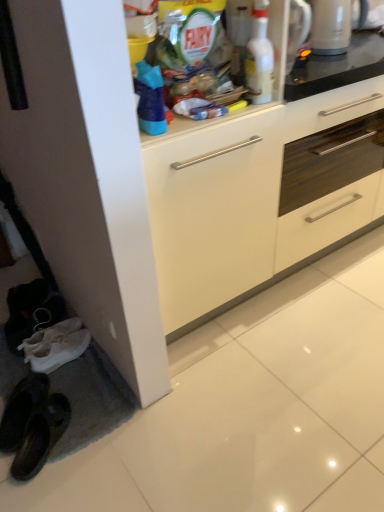
What is the approximate height of white glossy cabinet at center?

It is 35.85 inches.

This screenshot has height=512, width=384. What are the coordinates of `white glossy cabinet at center` in the screenshot? It's located at (260, 196).

Is point (326, 37) farther from viewer compared to point (183, 174)?

Yes, it is behind point (183, 174).

Relative to white glossy cabinet at center, is white glossy kettle at upper right in front or behind?

Visually, white glossy kettle at upper right is located behind white glossy cabinet at center.

Which of these two, white glossy kettle at upper right or white glossy cabinet at center, stands taller?

Standing taller between the two is white glossy cabinet at center.

How far apart are white glossy kettle at upper right and white glossy cabinet at center?

They are 22.50 inches apart.

Considering the positions of points (283, 272) and (326, 37), is point (283, 272) farther from camera compared to point (326, 37)?

Yes.

From the image's perspective, between white glossy cabinet at center and white glossy kettle at upper right, which one is located above?

white glossy kettle at upper right appears higher in the image.

Considering the relative sizes of white glossy cabinet at center and white glossy kettle at upper right in the image provided, is white glossy cabinet at center smaller than white glossy kettle at upper right?

Incorrect, white glossy cabinet at center is not smaller in size than white glossy kettle at upper right.

Would you say white glossy cabinet at center is outside white glossy kettle at upper right?

That's correct, white glossy cabinet at center is outside of white glossy kettle at upper right.

Is white glossy kettle at upper right bigger or smaller than white glossy bottle at upper center?

In the image, white glossy kettle at upper right appears to be larger than white glossy bottle at upper center.

From a real-world perspective, is white glossy kettle at upper right physically located above or below white glossy bottle at upper center?

In terms of real-world spatial position, white glossy kettle at upper right is below white glossy bottle at upper center.

Is white glossy kettle at upper right placed right next to white glossy bottle at upper center?

white glossy kettle at upper right is not next to white glossy bottle at upper center, and they're not touching.

Who is shorter, white glossy kettle at upper right or white glossy bottle at upper center?

white glossy kettle at upper right.

From the image's perspective, who appears lower, white glossy bottle at upper center or white glossy kettle at upper right?

white glossy bottle at upper center.

Is white glossy bottle at upper center far from white glossy kettle at upper right?

No, there isn't a large distance between white glossy bottle at upper center and white glossy kettle at upper right.

Based on the photo, which object is wider, white glossy bottle at upper center or white glossy kettle at upper right?

With larger width is white glossy kettle at upper right.

Is white glossy bottle at upper center surrounding white glossy kettle at upper right?

Definitely not — white glossy kettle at upper right is not inside white glossy bottle at upper center.

Can you confirm if white glossy cabinet at center is thinner than white glossy bottle at upper center?

No, white glossy cabinet at center is not thinner than white glossy bottle at upper center.

Does white glossy cabinet at center contain white glossy bottle at upper center?

No, white glossy bottle at upper center is not surrounded by white glossy cabinet at center.

Considering the relative positions of white glossy cabinet at center and white glossy bottle at upper center in the image provided, is white glossy cabinet at center to the right of white glossy bottle at upper center from the viewer's perspective?

Yes, white glossy cabinet at center is to the right of white glossy bottle at upper center.

Would you consider white glossy cabinet at center to be distant from white glossy bottle at upper center?

They are positioned close to each other.

Looking at their sizes, would you say white glossy bottle at upper center is wider or thinner than white glossy cabinet at center?

Clearly, white glossy bottle at upper center has less width compared to white glossy cabinet at center.

From a real-world perspective, does white glossy bottle at upper center stand above white glossy cabinet at center?

Yes, from a real-world perspective, white glossy bottle at upper center is above white glossy cabinet at center.

Where is `appliance on the left of white glossy cabinet at center`? appliance on the left of white glossy cabinet at center is located at coordinates (331, 27).

At what (x,y) coordinates should I click in order to perform the action: click on appliance above the white glossy cabinet at center (from the image's perspective). Please return your answer as a coordinate pair (x, y). Looking at the image, I should click on (331, 27).

From the image, which object appears to be nearer to white glossy kettle at upper right, white glossy bottle at upper center or white glossy cabinet at center?

Based on the image, white glossy bottle at upper center appears to be nearer to white glossy kettle at upper right.

In the scene shown: Which object lies further to the anchor point white glossy cabinet at center, white glossy bottle at upper center or white glossy kettle at upper right?

white glossy kettle at upper right is further to white glossy cabinet at center.

Looking at this image, based on their spatial positions, is white glossy cabinet at center or white glossy bottle at upper center further from white glossy kettle at upper right?

white glossy cabinet at center.

Considering their positions, is white glossy kettle at upper right positioned further to white glossy cabinet at center than white glossy bottle at upper center?

white glossy kettle at upper right.

Looking at the image, which one is located closer to white glossy bottle at upper center, white glossy kettle at upper right or white glossy cabinet at center?

white glossy kettle at upper right is closer to white glossy bottle at upper center.

Looking at the image, which one is located closer to white glossy bottle at upper center, white glossy cabinet at center or white glossy kettle at upper right?

white glossy kettle at upper right is positioned closer to the anchor white glossy bottle at upper center.

Where is `appliance situated between white glossy bottle at upper center and white glossy cabinet at center from left to right`? The height and width of the screenshot is (512, 384). appliance situated between white glossy bottle at upper center and white glossy cabinet at center from left to right is located at coordinates (331, 27).